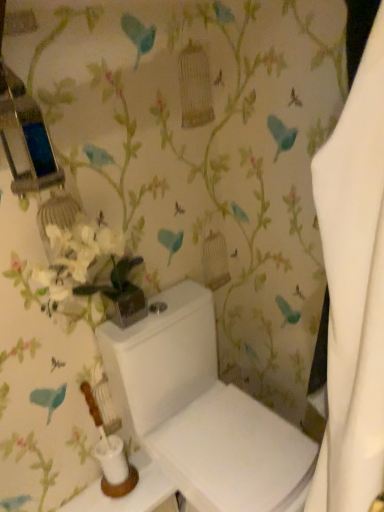
Where is `free space above white glossy toilet tank at lower center (from a real-world perspective)`? free space above white glossy toilet tank at lower center (from a real-world perspective) is located at coordinates (131, 484).